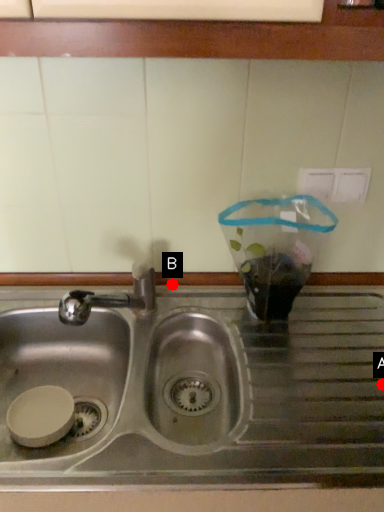
Question: Two points are circled on the image, labeled by A and B beside each circle. Which point is farther from the camera taking this photo?

Choices:
 (A) A is further
 (B) B is further

Answer: (B)